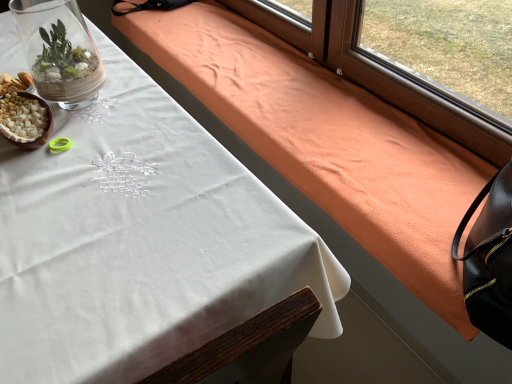
Question: Would you say white matte bowl at lower left is inside or outside clear glass terrarium at upper left?

Choices:
 (A) outside
 (B) inside

Answer: (A)

Question: Considering the positions of white matte bowl at lower left and clear glass terrarium at upper left in the image, is white matte bowl at lower left wider or thinner than clear glass terrarium at upper left?

Choices:
 (A) thin
 (B) wide

Answer: (A)

Question: Which object is the closest to the white matte bowl at lower left?

Choices:
 (A) orange suede blanket at upper right
 (B) white cloth at upper left
 (C) clear glass terrarium at upper left

Answer: (B)

Question: Considering the real-world distances, which object is closest to the white cloth at upper left?

Choices:
 (A) white matte bowl at lower left
 (B) orange suede blanket at upper right
 (C) clear glass terrarium at upper left

Answer: (A)